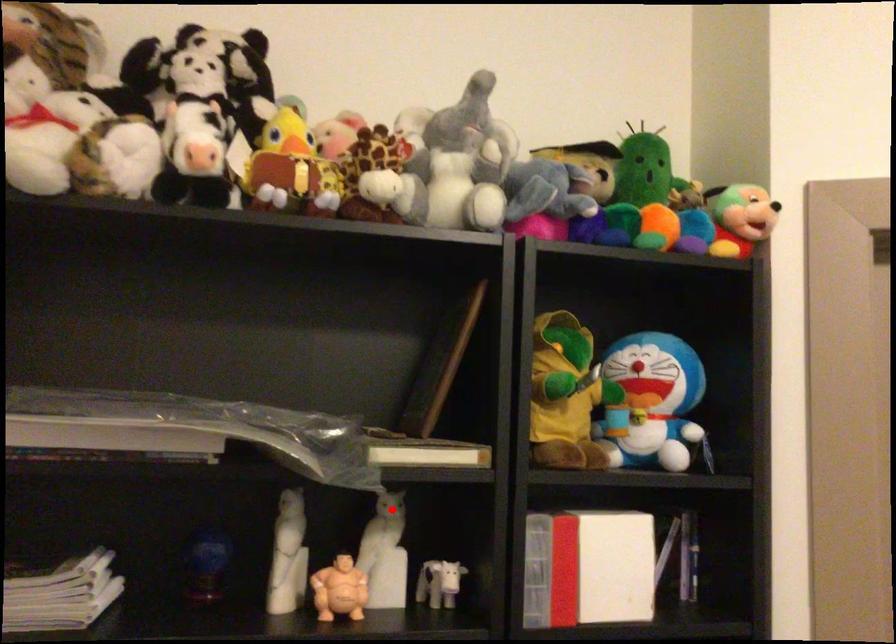
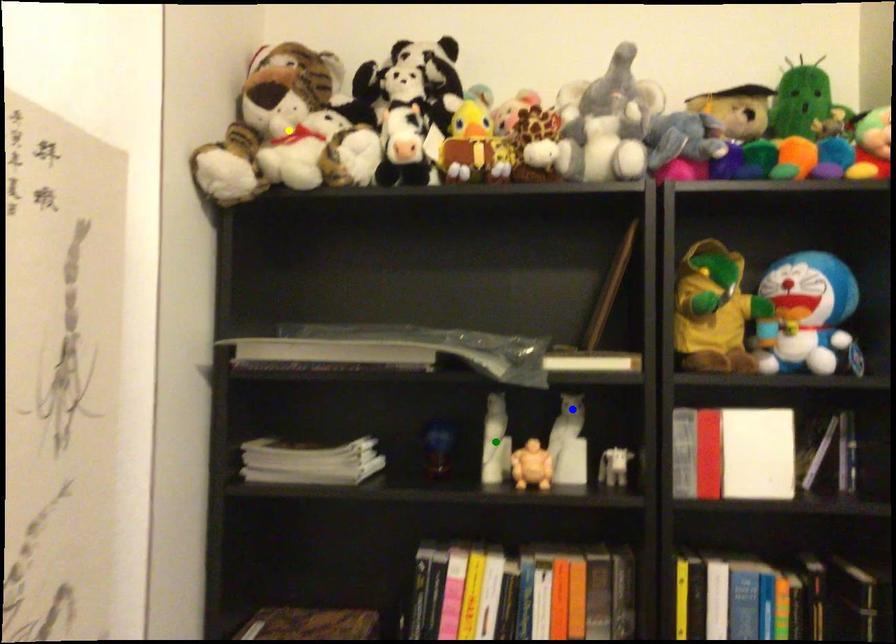
Question: I am providing you with two images of the same scene from different viewpoints. A red point is marked on the first image. You are given multiple points on the second image. Can you choose the point in image 2 that corresponds to the point in image 1?

Choices:
 (A) blue point
 (B) green point
 (C) yellow point

Answer: (A)